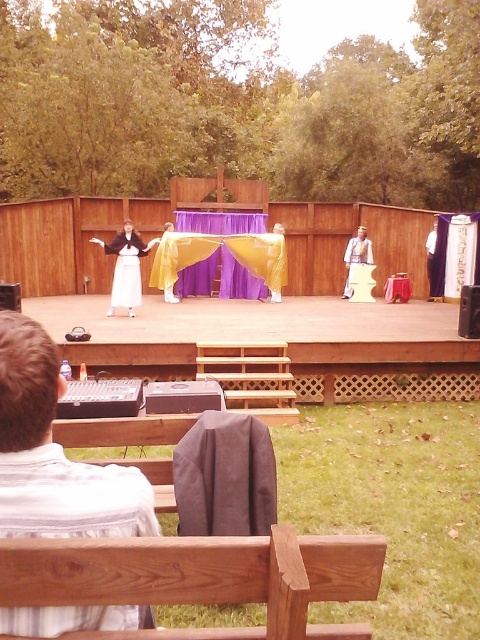
Consider the image. Can you confirm if purple velvet curtain at center is shorter than white satin dress at center?

Correct, purple velvet curtain at center is not as tall as white satin dress at center.

Who is taller, purple velvet curtain at center or white satin dress at center?

With more height is white satin dress at center.

Locate an element on the screen. purple velvet curtain at center is located at coordinates (219, 278).

Is striped cotton shirt at lower left to the right of matte black robe at center from the viewer's perspective?

Correct, you'll find striped cotton shirt at lower left to the right of matte black robe at center.

Who is more distant from viewer, (27, 355) or (135, 236)?

Positioned behind is point (135, 236).

Identify the location of striped cotton shirt at lower left. The image size is (480, 640). (x=55, y=454).

Image resolution: width=480 pixels, height=640 pixels. Identify the location of matte black robe at center. (126, 268).

Between point (134, 284) and point (139, 291), which one is positioned in front?

Point (134, 284)

Measure the distance between matte black robe at center and camera.

matte black robe at center and camera are 8.49 meters apart.

Locate an element on the screen. matte black robe at center is located at coordinates (126, 268).